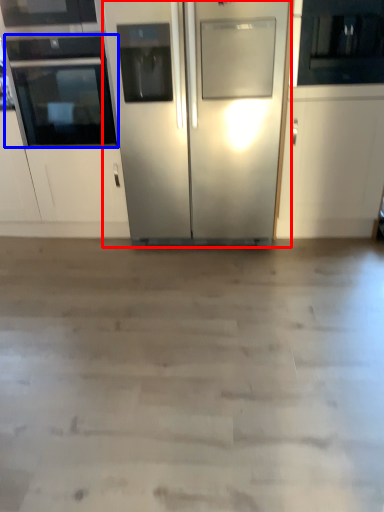
Question: Which object is further to the camera taking this photo, refrigerator (highlighted by a red box) or oven (highlighted by a blue box)?

Choices:
 (A) refrigerator
 (B) oven

Answer: (B)